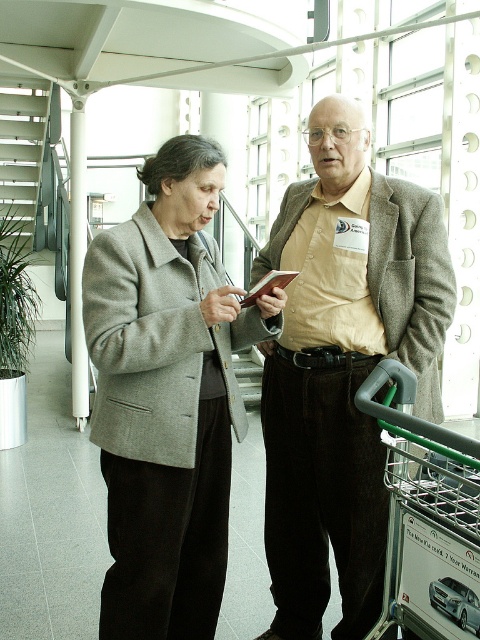
Is beige woolen blazer at center thinner than gray woolen coat at center?

No.

In the scene shown: Is beige woolen blazer at center closer to camera compared to gray woolen coat at center?

No, it is behind gray woolen coat at center.

Is point (354, 332) closer to viewer compared to point (223, 440)?

That is True.

Where is `beige woolen blazer at center`? The image size is (480, 640). beige woolen blazer at center is located at coordinates (343, 368).

Does beige woolen blazer at center appear over green metallic shopping cart at lower right?

Correct, beige woolen blazer at center is located above green metallic shopping cart at lower right.

Between point (379, 545) and point (470, 515), which one is positioned behind?

The point (379, 545) is more distant.

The image size is (480, 640). Identify the location of beige woolen blazer at center. (343, 368).

Is gray woolen coat at center closer to the viewer compared to green metallic shopping cart at lower right?

No, gray woolen coat at center is further to the viewer.

Is point (145, 328) farther from viewer compared to point (432, 637)?

Yes, it is.

What are the coordinates of `gray woolen coat at center` in the screenshot? It's located at (167, 396).